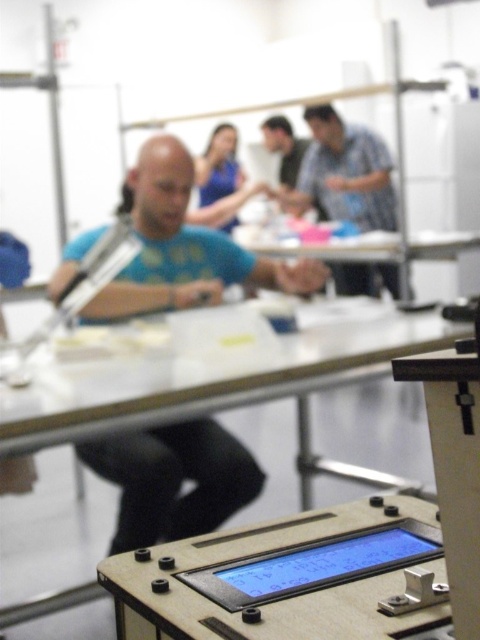
Question: Is blue t-shirt at center positioned at the back of blue fabric shirt at upper center?

Choices:
 (A) no
 (B) yes

Answer: (A)

Question: Which object appears farthest from the camera in this image?

Choices:
 (A) white glossy table at center
 (B) matte blue shirt at upper center

Answer: (B)

Question: Where is matte blue shirt at upper center located in relation to white glossy table at center in the image?

Choices:
 (A) below
 (B) above

Answer: (B)

Question: Which of the following is the closest to the observer?

Choices:
 (A) (210, 218)
 (B) (357, 193)

Answer: (B)

Question: Can you confirm if blue t-shirt at center is bigger than white glossy table at center?

Choices:
 (A) no
 (B) yes

Answer: (A)

Question: Estimate the real-world distances between objects in this image. Which object is closer to the white glossy table at center?

Choices:
 (A) blue fabric shirt at upper center
 (B) blue t-shirt at center

Answer: (A)